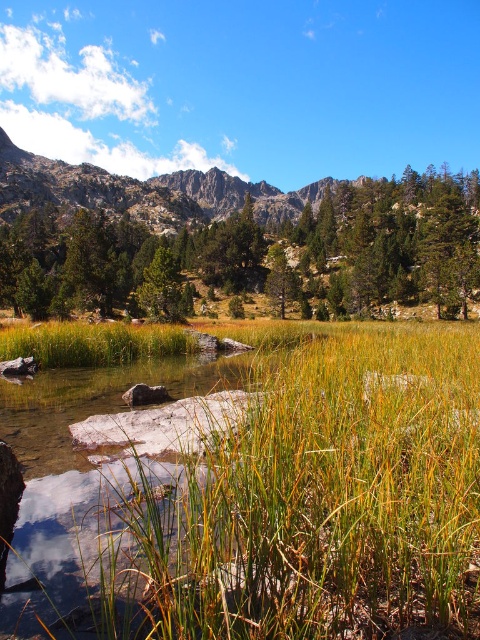
You are standing at the edge of the shallow water and want to walk towards the green matte tree at center. Which direction should you walk to reach it without crossing the green grass at center?

You should walk towards the green matte tree at center while avoiding the green grass at center since the green grass at center is located below the green matte tree at center, meaning it is between you and the tree. To avoid it, walk around either the left or right side of the green grass at center to reach the tree.

You are an artist planning to paint this mountain landscape. You want to emphasize the green matte tree at upper center and the rugged granite mountain at upper left in your painting. Based on their sizes, which object should you make larger to maintain the scene proportions?

The green matte tree at upper center should be made larger than the rugged granite mountain at upper left in the painting to maintain the scene proportions since it has a larger size compared to the rugged granite mountain at upper left according to the description.